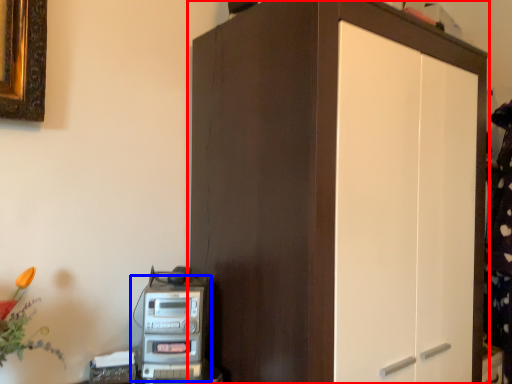
Question: Which of the following is the closest to the observer, cupboard (highlighted by a red box) or home appliance (highlighted by a blue box)?

Choices:
 (A) cupboard
 (B) home appliance

Answer: (A)